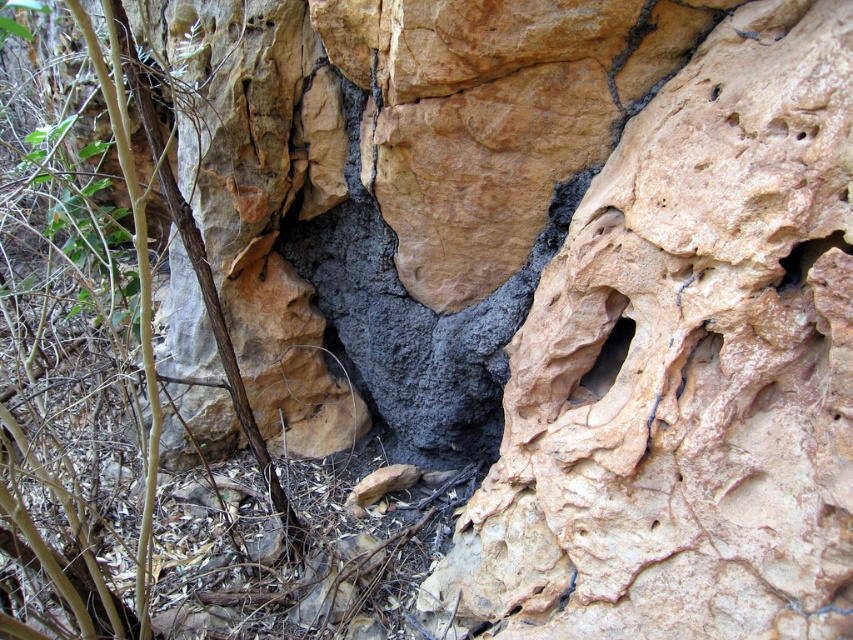
Does smooth stone hole at center have a greater width compared to smooth gray rock at upper right?

Yes, smooth stone hole at center is wider than smooth gray rock at upper right.

This screenshot has height=640, width=853. In order to click on smooth stone hole at center in this screenshot , I will do `click(604, 364)`.

Identify the location of smooth stone hole at center. The width and height of the screenshot is (853, 640). (604, 364).